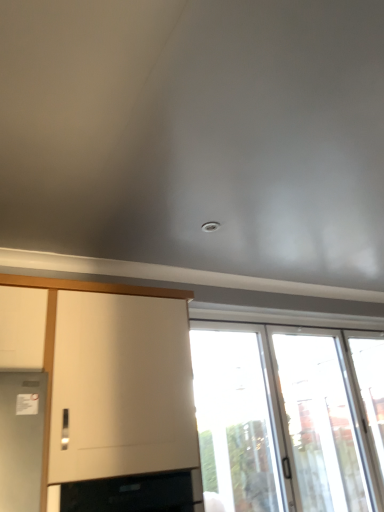
Question: In terms of height, does transparent glass door at right, which is counted as the 2th window, starting from the left, look taller or shorter compared to transparent glass screen door at right?

Choices:
 (A) tall
 (B) short

Answer: (B)

Question: In terms of size, does transparent glass door at right, positioned as the first window in right-to-left order, appear bigger or smaller than transparent glass screen door at right?

Choices:
 (A) big
 (B) small

Answer: (B)

Question: Which of these objects is positioned farthest from the transparent glass screen door at right?

Choices:
 (A) transparent glass door at right, positioned as the first window in right-to-left order
 (B) black glass oven at lower left
 (C) transparent glass window at lower right, the 1th window in the left-to-right sequence

Answer: (B)

Question: Which object is the closest to the black glass oven at lower left?

Choices:
 (A) transparent glass window at lower right, the 1th window in the left-to-right sequence
 (B) transparent glass screen door at right
 (C) transparent glass door at right, positioned as the first window in right-to-left order

Answer: (A)